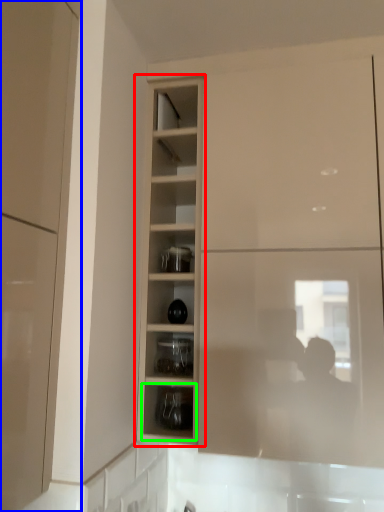
Question: Which is farther away from cupboard (highlighted by a red box)? cabinetry (highlighted by a blue box) or shelf (highlighted by a green box)?

Choices:
 (A) cabinetry
 (B) shelf

Answer: (A)